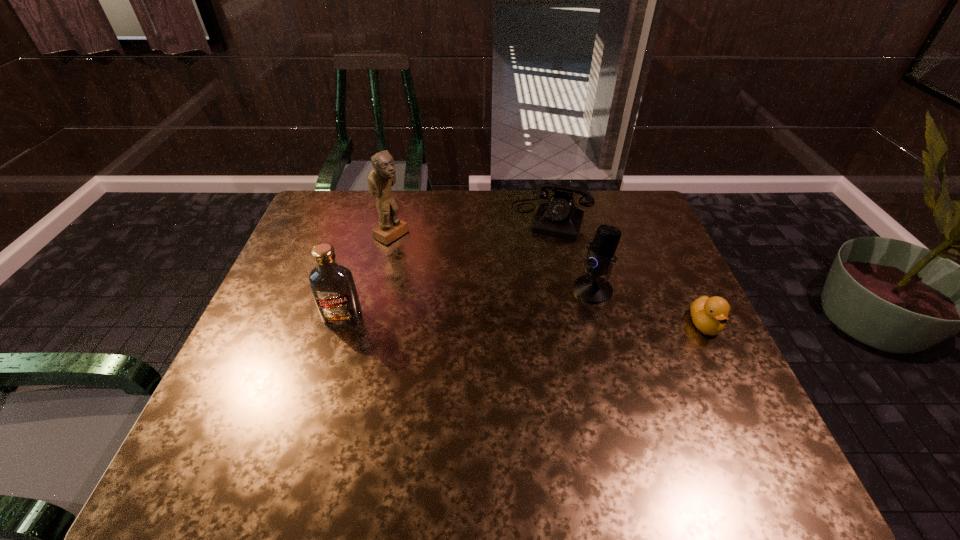
Find the location of a particular element. This screenshot has width=960, height=540. vacant area that lies between the third farthest object and the rightmost object is located at coordinates (649, 307).

Where is `free space between the figurine and the telephone`? The width and height of the screenshot is (960, 540). free space between the figurine and the telephone is located at coordinates (471, 226).

Identify the location of free space between the tallest object and the telephone. This screenshot has width=960, height=540. (471, 226).

The height and width of the screenshot is (540, 960). I want to click on vacant area between the telephone and the vodka, so (x=447, y=267).

I want to click on vacant area that lies between the third nearest object and the rightmost object, so click(649, 307).

The width and height of the screenshot is (960, 540). Identify the location of free spot between the duckling and the vodka. (524, 321).

Find the location of a particular element. The image size is (960, 540). vacant region between the vodka and the figurine is located at coordinates (367, 276).

Find the location of a particular element. object that is the second closest one to the duckling is located at coordinates pyautogui.click(x=559, y=217).

Image resolution: width=960 pixels, height=540 pixels. Find the location of `object that is the fourth closest to the telephone`. object that is the fourth closest to the telephone is located at coordinates (333, 287).

Locate an element on the screen. This screenshot has height=540, width=960. free space that satisfies the following two spatial constraints: 1. on the back side of the telephone; 2. on the left side of the tallest object is located at coordinates (396, 218).